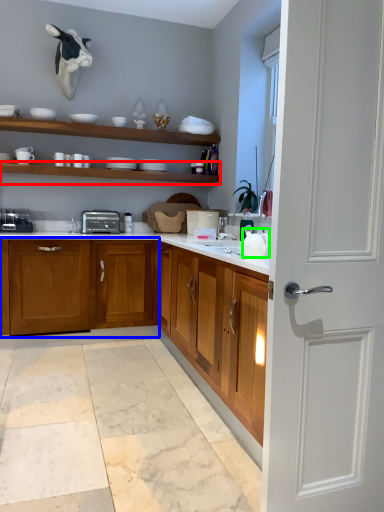
Question: Considering the real-world distances, which object is closest to shelf (highlighted by a red box)? cabinetry (highlighted by a blue box) or tea pot (highlighted by a green box).

Choices:
 (A) cabinetry
 (B) tea pot

Answer: (A)